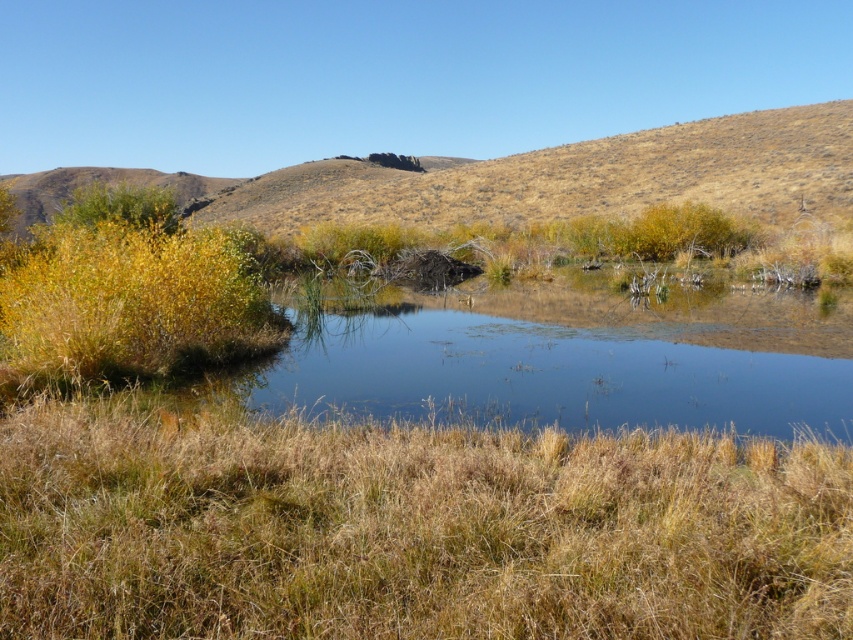
Question: Among these points, which one is farthest from the camera?

Choices:
 (A) (354, 470)
 (B) (616, 211)

Answer: (B)

Question: Where is dry grass at center located in relation to dry grass at upper center in the image?

Choices:
 (A) left
 (B) right

Answer: (B)

Question: Can you confirm if dry grass at center is bigger than dry grass at upper center?

Choices:
 (A) yes
 (B) no

Answer: (B)

Question: Is dry grass at center closer to the viewer compared to dry grass at upper center?

Choices:
 (A) yes
 (B) no

Answer: (A)

Question: Among these points, which one is farthest from the camera?

Choices:
 (A) (410, 204)
 (B) (235, 499)

Answer: (A)